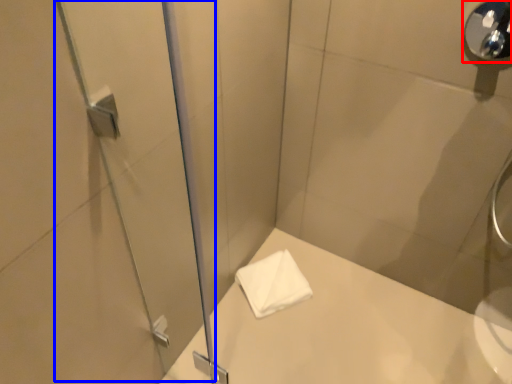
Question: Among these objects, which one is nearest to the camera, shower (highlighted by a red box) or screen door (highlighted by a blue box)?

Choices:
 (A) shower
 (B) screen door

Answer: (B)